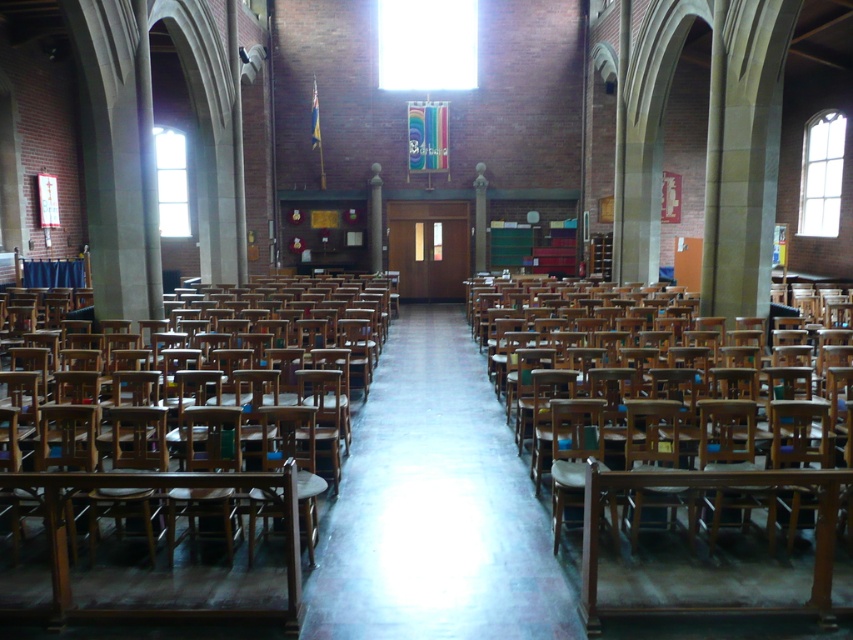
Question: Which point appears farthest from the camera in this image?

Choices:
 (A) (733, 589)
 (B) (20, 560)

Answer: (B)

Question: Does wooden at center have a larger size compared to wooden at right?

Choices:
 (A) yes
 (B) no

Answer: (A)

Question: Is wooden at center behind wooden at right?

Choices:
 (A) yes
 (B) no

Answer: (B)

Question: Is wooden at center above wooden at right?

Choices:
 (A) yes
 (B) no

Answer: (A)

Question: Among these points, which one is farthest from the camera?

Choices:
 (A) (309, 464)
 (B) (744, 572)

Answer: (A)